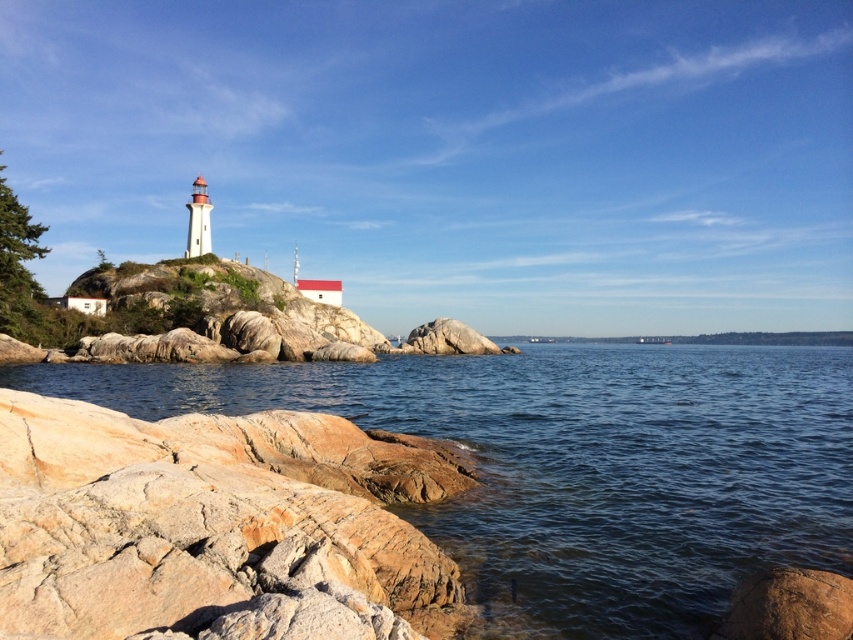
Question: Which point is closer to the camera?

Choices:
 (A) clear water at lower left
 (B) brown rough rock at lower right

Answer: (B)

Question: Can you confirm if clear water at lower left is positioned to the right of brown rough rock at lower right?

Choices:
 (A) no
 (B) yes

Answer: (B)

Question: Can you confirm if clear water at lower left is thinner than brown rough rock at lower right?

Choices:
 (A) no
 (B) yes

Answer: (A)

Question: Is clear water at lower left wider than brown rough rock at lower right?

Choices:
 (A) yes
 (B) no

Answer: (A)